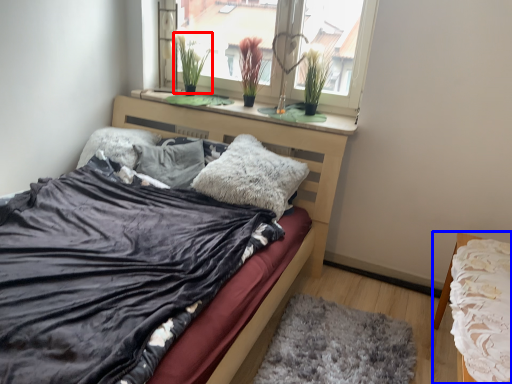
Question: Which object is further to the camera taking this photo, plant (highlighted by a red box) or nightstand (highlighted by a blue box)?

Choices:
 (A) plant
 (B) nightstand

Answer: (A)